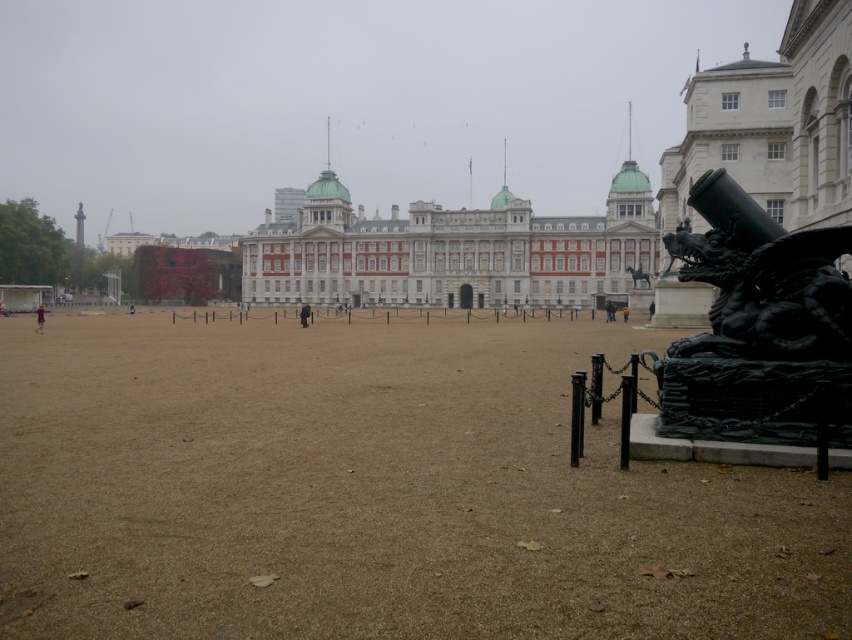
In the scene shown: You are standing at the center of the square facing the historical building. A black polished statue at center right is located at point (639, 275). If you walk straight towards the historical building, will you pass by the black polished statue at center right?

The point (639, 275) corresponds to the black polished statue at center right. Since you are facing the historical building and walking straight towards it, you would be moving along a path that does not pass through the center right area where the statue is located. Therefore, you will not pass by the black polished statue at center right.

You are standing in the square and want to take a photo of the historical building. You notice a point at coordinates (639, 275) on the image. Where is this point located in relation to the black polished statue at center right?

The point at coordinates (639, 275) is located on the black polished statue at center right.